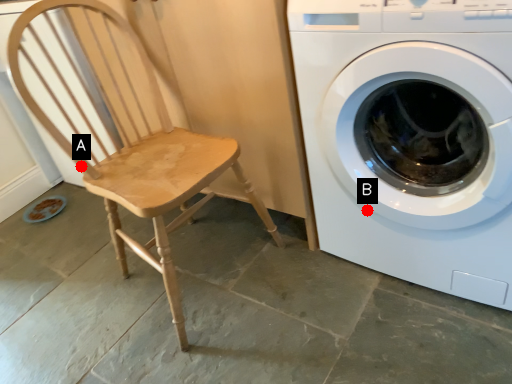
Question: Two points are circled on the image, labeled by A and B beside each circle. Which point appears closest to the camera in this image?

Choices:
 (A) A is closer
 (B) B is closer

Answer: (B)